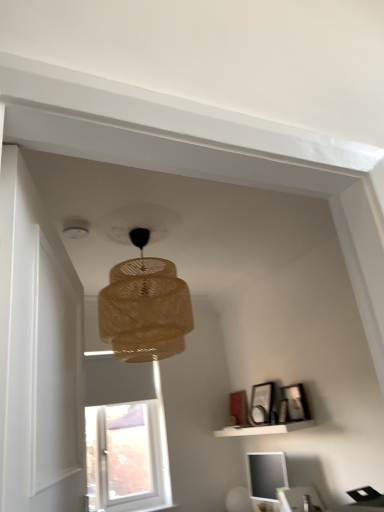
Question: Is braided wicker lampshade at center to the left of white matte shelf at lower right from the viewer's perspective?

Choices:
 (A) yes
 (B) no

Answer: (A)

Question: Is braided wicker lampshade at center not inside white matte shelf at lower right?

Choices:
 (A) yes
 (B) no

Answer: (A)

Question: Considering the relative sizes of braided wicker lampshade at center and white matte shelf at lower right in the image provided, is braided wicker lampshade at center shorter than white matte shelf at lower right?

Choices:
 (A) no
 (B) yes

Answer: (A)

Question: Does braided wicker lampshade at center have a smaller size compared to white matte shelf at lower right?

Choices:
 (A) yes
 (B) no

Answer: (B)

Question: Can you confirm if braided wicker lampshade at center is taller than white matte shelf at lower right?

Choices:
 (A) yes
 (B) no

Answer: (A)

Question: From a real-world perspective, is matte black picture frame at upper right, which ranks as the 1th picture frame in right-to-left order, physically located above or below white matte shelf at lower right?

Choices:
 (A) below
 (B) above

Answer: (B)

Question: Would you say matte black picture frame at upper right, which ranks as the 1th picture frame in right-to-left order, is to the left or to the right of white matte shelf at lower right in the picture?

Choices:
 (A) left
 (B) right

Answer: (B)

Question: Is matte black picture frame at upper right, positioned as the second picture frame in left-to-right order, wider or thinner than white matte shelf at lower right?

Choices:
 (A) thin
 (B) wide

Answer: (A)

Question: Based on their sizes in the image, would you say matte black picture frame at upper right, positioned as the second picture frame in left-to-right order, is bigger or smaller than white matte shelf at lower right?

Choices:
 (A) big
 (B) small

Answer: (B)

Question: From a real-world perspective, is matte black picture frame at upper right, the 1th picture frame positioned from the left, physically located above or below matte black monitor at lower right?

Choices:
 (A) above
 (B) below

Answer: (A)

Question: Is matte black picture frame at upper right, the 1th picture frame positioned from the left, situated inside matte black monitor at lower right or outside?

Choices:
 (A) inside
 (B) outside

Answer: (B)

Question: In terms of height, does matte black picture frame at upper right, the 1th picture frame positioned from the left, look taller or shorter compared to matte black monitor at lower right?

Choices:
 (A) tall
 (B) short

Answer: (B)

Question: In the image, is matte black picture frame at upper right, the 1th picture frame positioned from the left, on the left side or the right side of matte black monitor at lower right?

Choices:
 (A) left
 (B) right

Answer: (A)

Question: Do you think white matte shelf at lower right is within white wooden door at left, or outside of it?

Choices:
 (A) inside
 (B) outside

Answer: (B)

Question: From their relative heights in the image, would you say white matte shelf at lower right is taller or shorter than white wooden door at left?

Choices:
 (A) short
 (B) tall

Answer: (A)